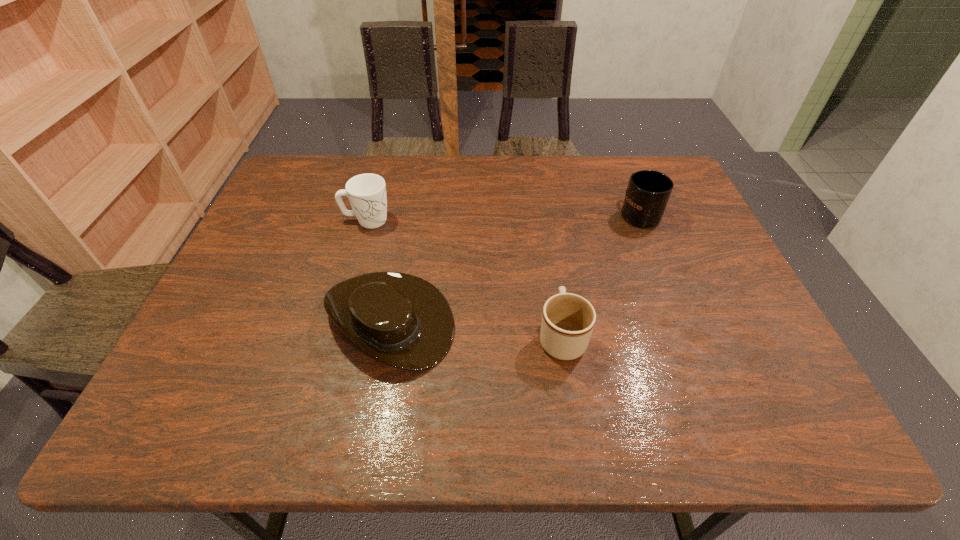
Locate an element on the screen. Image resolution: width=960 pixels, height=540 pixels. vacant space at the far left corner of the desktop is located at coordinates (328, 160).

What are the coordinates of `free spot at the near left corner of the desktop` in the screenshot? It's located at (205, 431).

Where is `vacant space at the far right corner`? This screenshot has height=540, width=960. vacant space at the far right corner is located at coordinates (673, 172).

At what (x,y) coordinates should I click in order to perform the action: click on vacant space in between the leftmost mug and the cowboy hat. Please return your answer as a coordinate pair (x, y). Looking at the image, I should click on (378, 271).

Identify the location of free space between the shortest object and the second mug from left to right. This screenshot has width=960, height=540. (475, 328).

Where is `free space that is in between the leftmost mug and the shortest object`? free space that is in between the leftmost mug and the shortest object is located at coordinates (378, 271).

The width and height of the screenshot is (960, 540). I want to click on free area in between the rightmost object and the cowboy hat, so click(x=514, y=267).

Locate an element on the screen. Image resolution: width=960 pixels, height=540 pixels. empty space that is in between the rightmost object and the leftmost mug is located at coordinates (503, 217).

The width and height of the screenshot is (960, 540). What are the coordinates of `unoccupied area between the shortest object and the leftmost mug` in the screenshot? It's located at (378, 271).

Find the location of a particular element. vacant area that lies between the rightmost object and the second object from right to left is located at coordinates (600, 275).